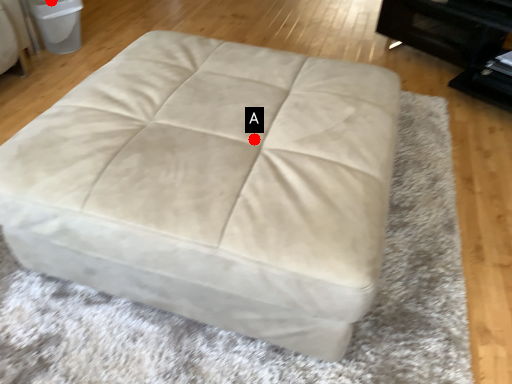
Question: Two points are circled on the image, labeled by A and B beside each circle. Which point is closer to the camera?

Choices:
 (A) A is closer
 (B) B is closer

Answer: (A)